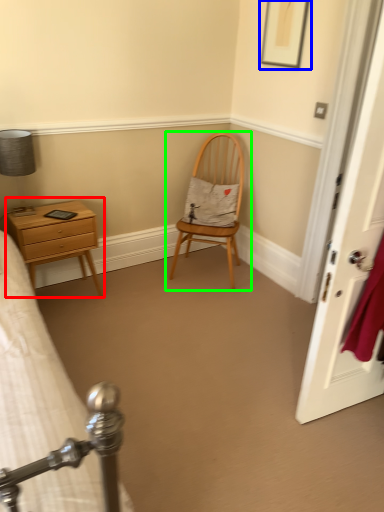
Question: Which object is the farthest from nightstand (highlighted by a red box)? Choose among these: picture frame (highlighted by a blue box) or chair (highlighted by a green box).

Choices:
 (A) picture frame
 (B) chair

Answer: (A)